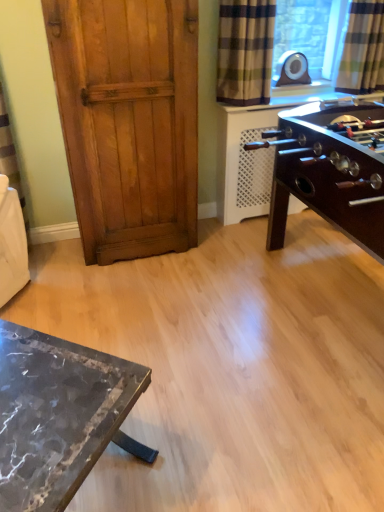
Question: Considering the relative positions of checkered fabric curtain at upper right, the second curtain in the left-to-right sequence, and marble table at lower left in the image provided, is checkered fabric curtain at upper right, the second curtain in the left-to-right sequence, to the left of marble table at lower left from the viewer's perspective?

Choices:
 (A) yes
 (B) no

Answer: (B)

Question: Is checkered fabric curtain at upper right, the second curtain in the left-to-right sequence, facing away from marble table at lower left?

Choices:
 (A) yes
 (B) no

Answer: (B)

Question: Is checkered fabric curtain at upper right, the second curtain in the left-to-right sequence, positioned far away from marble table at lower left?

Choices:
 (A) yes
 (B) no

Answer: (A)

Question: Is the position of checkered fabric curtain at upper right, the second curtain in the left-to-right sequence, less distant than that of marble table at lower left?

Choices:
 (A) no
 (B) yes

Answer: (A)

Question: From the image's perspective, does checkered fabric curtain at upper right, which appears as the 1th curtain when viewed from the right, appear higher than marble table at lower left?

Choices:
 (A) yes
 (B) no

Answer: (A)

Question: Are checkered fabric curtain at upper right, which appears as the 1th curtain when viewed from the right, and marble table at lower left beside each other?

Choices:
 (A) no
 (B) yes

Answer: (A)

Question: Can you confirm if plaid fabric curtain at upper right, which is the 1th curtain in left-to-right order, is bigger than wooden door at left?

Choices:
 (A) no
 (B) yes

Answer: (A)

Question: Is plaid fabric curtain at upper right, which is the 1th curtain in left-to-right order, looking in the opposite direction of wooden door at left?

Choices:
 (A) no
 (B) yes

Answer: (A)

Question: Is plaid fabric curtain at upper right, the second curtain in the right-to-left sequence, directly adjacent to wooden door at left?

Choices:
 (A) yes
 (B) no

Answer: (B)

Question: Can you confirm if plaid fabric curtain at upper right, the second curtain in the right-to-left sequence, is positioned to the left of wooden door at left?

Choices:
 (A) no
 (B) yes

Answer: (A)

Question: Could you tell me if plaid fabric curtain at upper right, which is the 1th curtain in left-to-right order, is turned towards wooden door at left?

Choices:
 (A) no
 (B) yes

Answer: (A)

Question: Is plaid fabric curtain at upper right, which is the 1th curtain in left-to-right order, not close to wooden door at left?

Choices:
 (A) yes
 (B) no

Answer: (B)

Question: From a real-world perspective, is checkered fabric curtain at upper right, which appears as the 1th curtain when viewed from the right, located beneath wooden door at left?

Choices:
 (A) yes
 (B) no

Answer: (B)